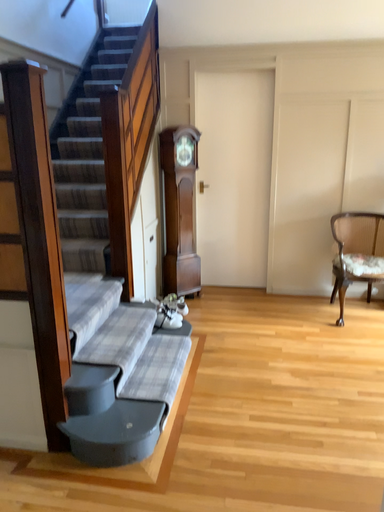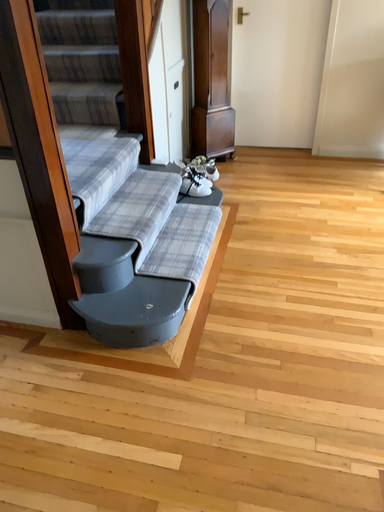
Question: Which way did the camera rotate in the video?

Choices:
 (A) rotated upward
 (B) rotated downward

Answer: (B)